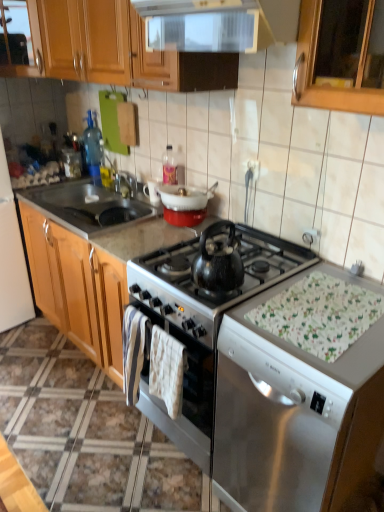
Describe the element at coordinates (202, 321) in the screenshot. I see `satin black kettle at center, which appears as the 2th appliance when viewed from the left` at that location.

The image size is (384, 512). Describe the element at coordinates (167, 370) in the screenshot. I see `white textured towel at center` at that location.

In order to face white glossy refrigerator at left, which appears as the 1th appliance when viewed from the left, should I rotate leftwards or rightwards?

Turn left by 26.535 degrees to look at white glossy refrigerator at left, which appears as the 1th appliance when viewed from the left.

Measure the distance between point (x=98, y=217) and camera.

The depth of point (x=98, y=217) is 7.13 feet.

You are a GUI agent. You are given a task and a screenshot of the screen. Output one action in this format:
    pyautogui.click(x=<x>, y=<y>)
    Task: Click on the white fabric placemat at lower right
    This screenshot has width=384, height=512.
    Given the screenshot: What is the action you would take?
    pyautogui.click(x=319, y=314)

The width and height of the screenshot is (384, 512). Describe the element at coordinates (294, 413) in the screenshot. I see `white glossy dishwasher at lower right` at that location.

Identify the location of satin black kettle at center, which appears as the first appliance when viewed from the right. (202, 321).

Considering the relative sizes of white marble countertop at center and satin black kettle at center, which appears as the 2th appliance when viewed from the left, in the image provided, is white marble countertop at center thinner than satin black kettle at center, which appears as the 2th appliance when viewed from the left,?

No.

Is white marble countertop at center closer to the viewer compared to satin black kettle at center, which appears as the first appliance when viewed from the right?

Yes, white marble countertop at center is in front of satin black kettle at center, which appears as the first appliance when viewed from the right.

Could you tell me if white marble countertop at center is turned towards satin black kettle at center, which appears as the 2th appliance when viewed from the left?

No, white marble countertop at center is not oriented towards satin black kettle at center, which appears as the 2th appliance when viewed from the left.

Consider the image. From a real-world perspective, who is located higher, metallic stainless steel sink at left, positioned as the 2th sink in right-to-left order, or shiny black kettle at center?

metallic stainless steel sink at left, positioned as the 2th sink in right-to-left order.

Is point (92, 183) closer or farther from the camera than point (137, 279)?

Point (92, 183) is positioned farther from the camera compared to point (137, 279).

You are a GUI agent. You are given a task and a screenshot of the screen. Output one action in this format:
    pyautogui.click(x=<x>, y=<y>)
    Task: Click on the 2nd sink counting from the left side of the shiny black kettle at center
    
    Given the screenshot: What is the action you would take?
    pyautogui.click(x=88, y=205)

Where is `appliance on the right of white glossy refrigerator at left, the 2th appliance viewed from the right`? appliance on the right of white glossy refrigerator at left, the 2th appliance viewed from the right is located at coordinates (202, 321).

Are satin black kettle at center, which appears as the 2th appliance when viewed from the left, and white glossy refrigerator at left, which appears as the 1th appliance when viewed from the left, making contact?

No, satin black kettle at center, which appears as the 2th appliance when viewed from the left, is not with white glossy refrigerator at left, which appears as the 1th appliance when viewed from the left.

Is satin black kettle at center, which appears as the first appliance when viewed from the right, aimed at white glossy refrigerator at left, which appears as the 1th appliance when viewed from the left?

No, satin black kettle at center, which appears as the first appliance when viewed from the right, is not facing towards white glossy refrigerator at left, which appears as the 1th appliance when viewed from the left.

Does satin black kettle at center, which appears as the 2th appliance when viewed from the left, appear on the right side of white glossy refrigerator at left, the 2th appliance viewed from the right?

Correct, you'll find satin black kettle at center, which appears as the 2th appliance when viewed from the left, to the right of white glossy refrigerator at left, the 2th appliance viewed from the right.

Does point (32, 218) appear closer or farther from the camera than point (313, 369)?

Point (32, 218).

Is white glossy dishwasher at lower right at the back of white marble countertop at center?

No, white glossy dishwasher at lower right is not at the back of white marble countertop at center.

From a real-world perspective, which object stands above the other?

From a 3D spatial view, white glossy dishwasher at lower right is above.

Which is behind, white marble countertop at center or white glossy dishwasher at lower right?

white marble countertop at center.

Is point (264, 279) positioned behind point (343, 345)?

Yes, point (264, 279) is behind point (343, 345).

Looking at this image, considering the relative positions of white marble countertop at center and white fabric placemat at lower right in the image provided, is white marble countertop at center to the left of white fabric placemat at lower right from the viewer's perspective?

Indeed, white marble countertop at center is positioned on the left side of white fabric placemat at lower right.

Can we say white marble countertop at center lies outside white fabric placemat at lower right?

white marble countertop at center is positioned outside white fabric placemat at lower right.

Relative to metallic stainless steel sink at left, positioned as the 1th sink in left-to-right order, is shiny black kettle at center in front or behind?

In the image, shiny black kettle at center appears in front of metallic stainless steel sink at left, positioned as the 1th sink in left-to-right order.

From a real-world perspective, is shiny black kettle at center positioned under metallic stainless steel sink at left, positioned as the 1th sink in left-to-right order, based on gravity?

Indeed, from a real-world perspective, shiny black kettle at center is positioned beneath metallic stainless steel sink at left, positioned as the 1th sink in left-to-right order.

In the scene shown: Who is bigger, shiny black kettle at center or metallic stainless steel sink at left, positioned as the 2th sink in right-to-left order?

shiny black kettle at center.

Where is `gas stove to the right of metallic stainless steel sink at left, positioned as the 1th sink in left-to-right order`? This screenshot has height=512, width=384. gas stove to the right of metallic stainless steel sink at left, positioned as the 1th sink in left-to-right order is located at coordinates (219, 267).

Is metallic stainless steel sink at left, positioned as the 2th sink in right-to-left order, positioned with its back to white glossy microwave at upper center?

No, metallic stainless steel sink at left, positioned as the 2th sink in right-to-left order, is not facing away from white glossy microwave at upper center.

Is metallic stainless steel sink at left, positioned as the 1th sink in left-to-right order, located outside white glossy microwave at upper center?

Yes.

Where is `appliance to the right of white marble countertop at center`? appliance to the right of white marble countertop at center is located at coordinates (202, 321).

I want to click on gas stove that is in front of the metallic stainless steel sink at left, positioned as the 2th sink in right-to-left order, so click(x=219, y=267).

When comparing their distances from white glossy dishwasher at lower right, does white marble countertop at center or metallic stainless steel sink at left, positioned as the 1th sink in left-to-right order, seem further?

metallic stainless steel sink at left, positioned as the 1th sink in left-to-right order, is further to white glossy dishwasher at lower right.

Looking at the image, which one is located further to satin black kettle at center, which appears as the first appliance when viewed from the right, shiny black kettle at center or white glossy microwave at upper center?

Based on the image, white glossy microwave at upper center appears to be further to satin black kettle at center, which appears as the first appliance when viewed from the right.

Looking at the image, which one is located further to white glossy microwave at upper center, white glossy refrigerator at left, the 2th appliance viewed from the right, or wooden cabinet at upper left?

Based on the image, white glossy refrigerator at left, the 2th appliance viewed from the right, appears to be further to white glossy microwave at upper center.

Consider the image. Looking at the image, which one is located further to white glossy microwave at upper center, metallic stainless steel sink at left, positioned as the 1th sink in left-to-right order, or white fabric placemat at lower right?

Based on the image, white fabric placemat at lower right appears to be further to white glossy microwave at upper center.

Consider the image. When comparing their distances from shiny black kettle at center, does white glossy dishwasher at lower right or satin black kettle at center, which appears as the 2th appliance when viewed from the left, seem further?

white glossy dishwasher at lower right is positioned further to the anchor shiny black kettle at center.

Estimate the real-world distances between objects in this image. Which object is further from white fabric placemat at lower right, wooden cabinet at upper left or satin black kettle at center, which appears as the first appliance when viewed from the right?

Based on the image, wooden cabinet at upper left appears to be further to white fabric placemat at lower right.

Estimate the real-world distances between objects in this image. Which object is further from black stainless steel sink at left, which appears as the 1th sink when viewed from the right, satin black kettle at center, which appears as the first appliance when viewed from the right, or white marble countertop at center?

Among the two, satin black kettle at center, which appears as the first appliance when viewed from the right, is located further to black stainless steel sink at left, which appears as the 1th sink when viewed from the right.

Which object lies further to the anchor point wooden cabinet at upper left, white marble countertop at center or metallic stainless steel sink at left, positioned as the 2th sink in right-to-left order?

Among the two, white marble countertop at center is located further to wooden cabinet at upper left.

What are the coordinates of `appliance between white glossy refrigerator at left, which appears as the 1th appliance when viewed from the left, and white fabric placemat at lower right, in the horizontal direction` in the screenshot? It's located at (202, 321).

The height and width of the screenshot is (512, 384). Find the location of `food between white glossy microwave at upper center and satin black kettle at center, which appears as the 2th appliance when viewed from the left, in the up-down direction`. food between white glossy microwave at upper center and satin black kettle at center, which appears as the 2th appliance when viewed from the left, in the up-down direction is located at coordinates (319, 314).

The height and width of the screenshot is (512, 384). I want to click on blanket between metallic stainless steel sink at left, positioned as the 2th sink in right-to-left order, and white marble countertop at center from top to bottom, so click(x=167, y=370).

Identify the location of appliance between white marble countertop at center and black stainless steel sink at left, which appears as the 1th sink when viewed from the right, from front to back. (202, 321).